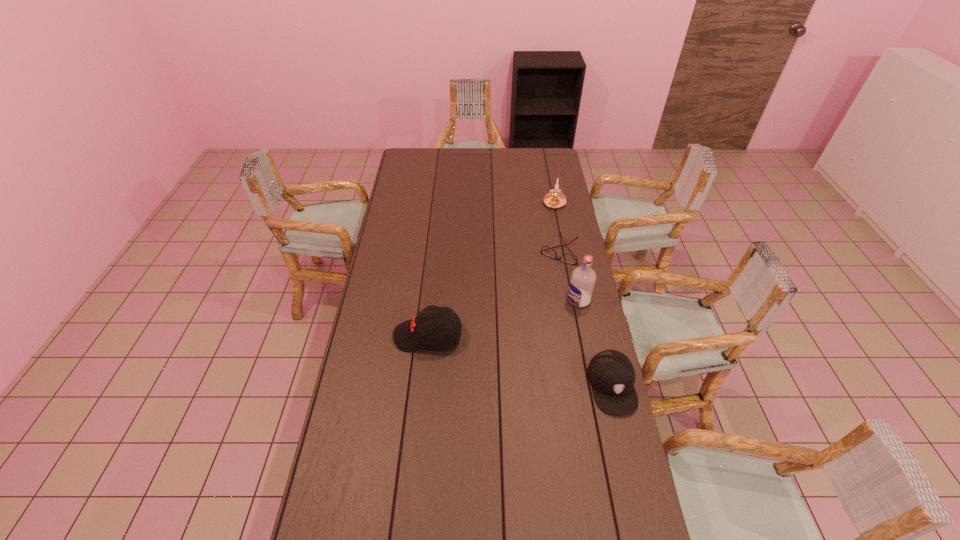
Locate an element on the screen. Image resolution: width=960 pixels, height=540 pixels. vacant space situated 0.330m on the handle side of the candle holder is located at coordinates (535, 255).

Where is `vacant point located on the handle side of the candle holder`? This screenshot has height=540, width=960. vacant point located on the handle side of the candle holder is located at coordinates (536, 253).

This screenshot has width=960, height=540. I want to click on object present at the left edge, so [438, 328].

I want to click on cap that is at the right edge, so click(x=612, y=376).

Where is `spectacles that is at the right edge`? The width and height of the screenshot is (960, 540). spectacles that is at the right edge is located at coordinates (546, 250).

You are a GUI agent. You are given a task and a screenshot of the screen. Output one action in this format:
    pyautogui.click(x=<x>, y=<y>)
    Task: Click on the vodka located at the right edge
    This screenshot has width=960, height=540.
    Given the screenshot: What is the action you would take?
    [581, 286]

The width and height of the screenshot is (960, 540). I want to click on candle holder that is at the right edge, so click(x=554, y=199).

Identify the location of vacant space at the far edge. The width and height of the screenshot is (960, 540). (493, 160).

Where is `vacant position at the near edge of the desktop`? The width and height of the screenshot is (960, 540). vacant position at the near edge of the desktop is located at coordinates (x=539, y=519).

Find the location of `free space at the left edge of the desktop`. free space at the left edge of the desktop is located at coordinates (415, 235).